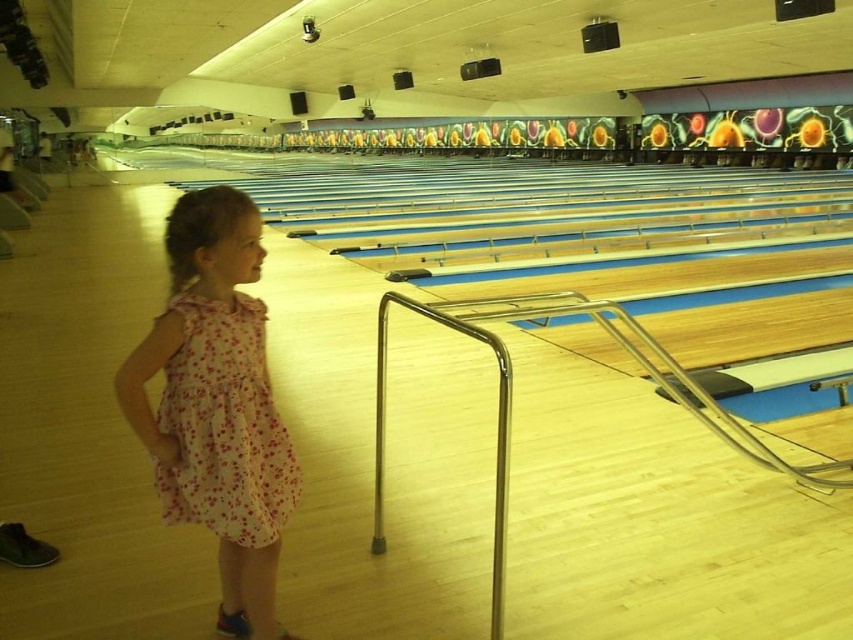
Does pink floral dress at center appear under floral cotton dress at left?

Yes.

Does pink floral dress at center have a larger size compared to floral cotton dress at left?

Yes.

Is point (154, 364) farther from camera compared to point (247, 355)?

No, (154, 364) is in front of (247, 355).

Locate an element on the screen. This screenshot has height=640, width=853. pink floral dress at center is located at coordinates (216, 403).